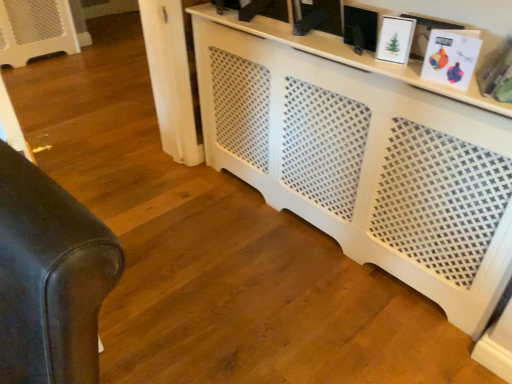
Image resolution: width=512 pixels, height=384 pixels. Identify the location of free point in front of white glossy picture frame at upper right, the second picture frame from the left. (404, 71).